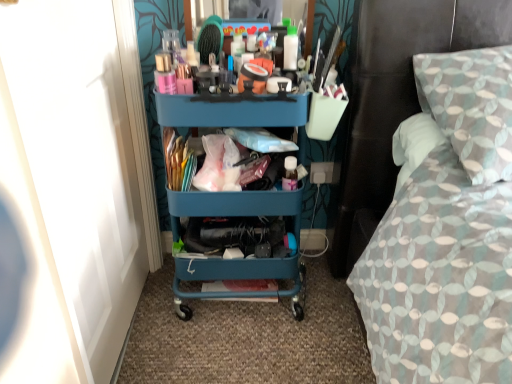
I want to click on free spot in front of teal plastic cart at center, so click(237, 349).